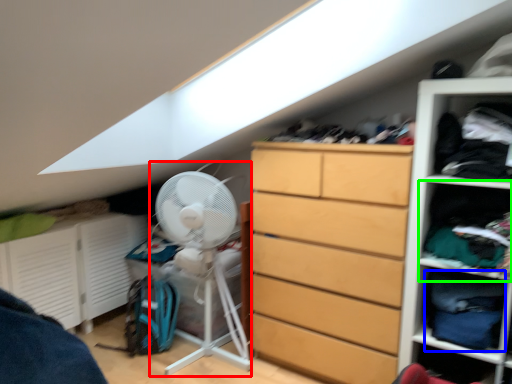
Question: Which object is the farthest from fan (highlighted by a red box)? Choose among these: clothing (highlighted by a blue box) or cabinet (highlighted by a green box).

Choices:
 (A) clothing
 (B) cabinet

Answer: (A)